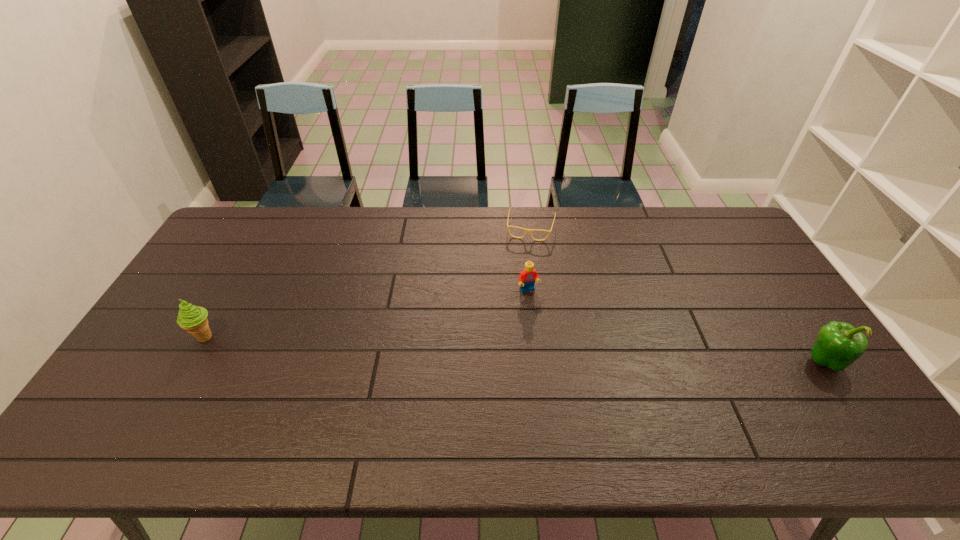
This screenshot has width=960, height=540. I want to click on vacant space at the far right corner of the desktop, so click(x=711, y=230).

At what (x,y) coordinates should I click in order to perform the action: click on vacant space that is in between the shortest object and the third tallest object. Please return your answer as a coordinate pair (x, y). Image resolution: width=960 pixels, height=540 pixels. Looking at the image, I should click on (530, 259).

Identify the location of empty space between the third nearest object and the icecream. (367, 314).

The width and height of the screenshot is (960, 540). I want to click on unoccupied position between the second farthest object and the leftmost object, so click(367, 314).

Image resolution: width=960 pixels, height=540 pixels. I want to click on blank region between the Lego and the shortest object, so click(x=530, y=259).

The image size is (960, 540). I want to click on free point between the bell pepper and the shortest object, so click(677, 294).

The image size is (960, 540). Find the location of `free space between the icecream and the shortest object`. free space between the icecream and the shortest object is located at coordinates (369, 282).

Identify the location of free space between the farthest object and the leftmost object. The height and width of the screenshot is (540, 960). (369, 282).

I want to click on empty space between the icecream and the spectacles, so click(x=369, y=282).

In order to click on vacant area between the second farthest object and the leftmost object in this screenshot , I will do `click(367, 314)`.